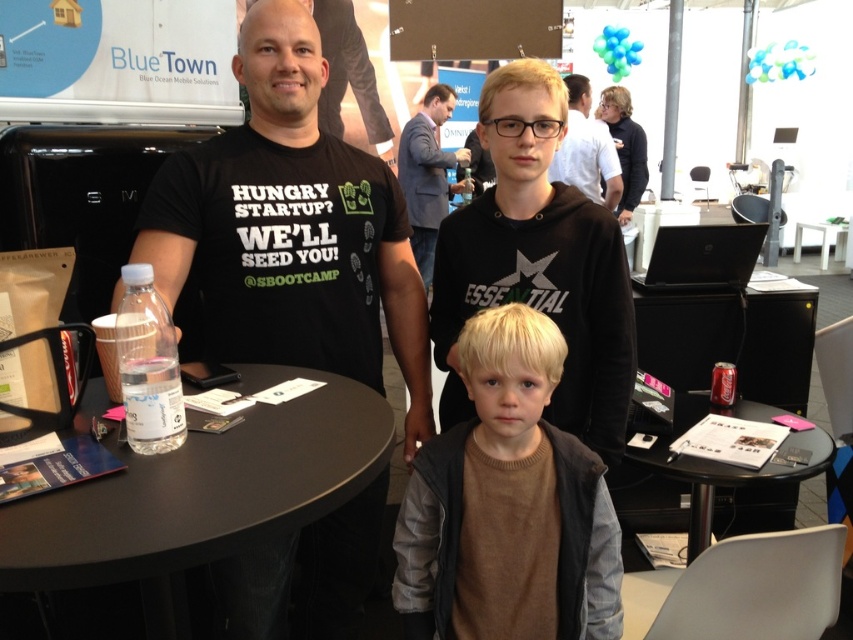
You are at a trade show and need to place a 10cm tall promotional model on the table. Can the transparent plastic table at center support the model without it falling off, considering the dark gray suit at center is currently on the table?

The transparent plastic table at center is below dark gray suit at center, meaning the suit is on the table. Since the table is designed to hold items like brochures and a water bottle, it should support the 10cm tall promotional model as long as there is enough space not occupied by the dark gray suit at center.